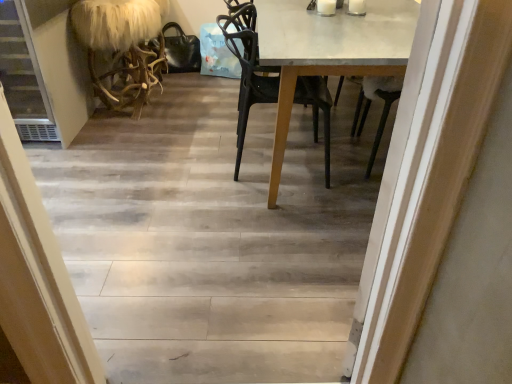
What do you see at coordinates (212, 237) in the screenshot?
I see `wooden floor at center` at bounding box center [212, 237].

Measure the distance between point (127, 210) and camera.

The distance of point (127, 210) from camera is 2.04 meters.

What do you see at coordinates (329, 51) in the screenshot? The width and height of the screenshot is (512, 384). I see `white glossy table at center` at bounding box center [329, 51].

What do you see at coordinates (122, 48) in the screenshot?
I see `fuzzy white fur at left` at bounding box center [122, 48].

Where is `black matte chair at center`? The height and width of the screenshot is (384, 512). black matte chair at center is located at coordinates (248, 69).

Find the location of a particular element. The width and height of the screenshot is (512, 384). wooden floor at center is located at coordinates (212, 237).

From the image's perspective, does white glossy table at center appear lower than fuzzy white fur at left?

Yes, from the image's perspective, white glossy table at center is beneath fuzzy white fur at left.

Consider the image. Could you tell me if white glossy table at center is facing fuzzy white fur at left?

Yes, white glossy table at center is turned towards fuzzy white fur at left.

From a real-world perspective, is white glossy table at center under fuzzy white fur at left?

Incorrect, from a real-world perspective, white glossy table at center is higher than fuzzy white fur at left.

Looking at this image, can you confirm if white glossy table at center is bigger than fuzzy white fur at left?

Indeed, white glossy table at center has a larger size compared to fuzzy white fur at left.

From a real-world perspective, is black matte chair at center located higher than white glossy table at center?

Yes, from a real-world perspective, black matte chair at center is on top of white glossy table at center.

How far apart are black matte chair at center and white glossy table at center?

11.37 inches.

Would you say black matte chair at center is to the left or to the right of white glossy table at center in the picture?

black matte chair at center is to the left of white glossy table at center.

Is black matte chair at center beside white glossy table at center?

No, black matte chair at center is not with white glossy table at center.

Is fuzzy white fur at left positioned behind wooden floor at center?

That is True.

Considering the relative sizes of fuzzy white fur at left and wooden floor at center in the image provided, is fuzzy white fur at left taller than wooden floor at center?

Indeed, fuzzy white fur at left has a greater height compared to wooden floor at center.

Would you say fuzzy white fur at left is inside or outside wooden floor at center?

fuzzy white fur at left is not inside wooden floor at center, it's outside.

From a real-world perspective, which object stands above the other?

fuzzy white fur at left.

From a real-world perspective, is black matte chair at center on wooden floor at center?

Correct, in the physical world, black matte chair at center is higher than wooden floor at center.

Is black matte chair at center next to wooden floor at center and touching it?

No, black matte chair at center is not making contact with wooden floor at center.

Is black matte chair at center spatially inside wooden floor at center, or outside of it?

black matte chair at center is located beyond the bounds of wooden floor at center.

Measure the distance between black matte chair at center and wooden floor at center.

black matte chair at center and wooden floor at center are 21.47 inches apart.

Which object is closer to the camera, white glossy table at center or black matte chair at center?

Positioned in front is white glossy table at center.

Is white glossy table at center facing towards black matte chair at center?

Yes, white glossy table at center is turned towards black matte chair at center.

Which is behind, point (311, 42) or point (317, 94)?

The point (317, 94) is farther.

Can black matte chair at center be found inside white glossy table at center?

Yes, white glossy table at center is surrounding black matte chair at center.

From the picture: From a real-world perspective, is wooden floor at center under black matte chair at center?

Yes.

Is point (123, 274) farther from viewer compared to point (247, 13)?

No, (123, 274) is in front of (247, 13).

Is there a large distance between wooden floor at center and black matte chair at center?

A: Actually, wooden floor at center and black matte chair at center are a little close together.

From the image's perspective, which one is positioned higher, fuzzy white fur at left or black matte chair at center?

fuzzy white fur at left appears higher in the image.

Consider the image. Which of these two, fuzzy white fur at left or black matte chair at center, is thinner?

fuzzy white fur at left is thinner.

What's the angular difference between fuzzy white fur at left and black matte chair at center's facing directions?

The facing directions of fuzzy white fur at left and black matte chair at center are 180 degrees apart.

Is fuzzy white fur at left to the left of black matte chair at center from the viewer's perspective?

Correct, you'll find fuzzy white fur at left to the left of black matte chair at center.

At what (x,y) coordinates should I click in order to perform the action: click on round table that is in front of the fuzzy white fur at left. Please return your answer as a coordinate pair (x, y). This screenshot has width=512, height=384. Looking at the image, I should click on (329, 51).

Identify the location of round table above the black matte chair at center (from the image's perspective). The width and height of the screenshot is (512, 384). (329, 51).

From the image, which object appears to be farther from black matte chair at center, wooden floor at center or fuzzy white fur at left?

Based on the image, fuzzy white fur at left appears to be further to black matte chair at center.

Which object lies nearer to the anchor point fuzzy white fur at left, black matte chair at center or wooden floor at center?

black matte chair at center lies closer to fuzzy white fur at left than the other object.

Considering their positions, is black matte chair at center positioned closer to white glossy table at center than wooden floor at center?

Based on the image, black matte chair at center appears to be nearer to white glossy table at center.

Looking at the image, which one is located closer to wooden floor at center, fuzzy white fur at left or white glossy table at center?

Among the two, white glossy table at center is located nearer to wooden floor at center.

When comparing their distances from wooden floor at center, does fuzzy white fur at left or black matte chair at center seem further?

fuzzy white fur at left is further to wooden floor at center.

Based on their spatial positions, is white glossy table at center or wooden floor at center further from fuzzy white fur at left?

The object further to fuzzy white fur at left is white glossy table at center.

Looking at the image, which one is located closer to wooden floor at center, black matte chair at center or white glossy table at center?

Based on the image, black matte chair at center appears to be nearer to wooden floor at center.

Looking at the image, which one is located closer to white glossy table at center, wooden floor at center or fuzzy white fur at left?

wooden floor at center is closer to white glossy table at center.

The height and width of the screenshot is (384, 512). Identify the location of chair between fuzzy white fur at left and white glossy table at center. (248, 69).

Find the location of `chair positioned between wooden floor at center and fuzzy white fur at left from near to far`. chair positioned between wooden floor at center and fuzzy white fur at left from near to far is located at coordinates (248, 69).

I want to click on chair located between wooden floor at center and white glossy table at center in the left-right direction, so click(248, 69).

Where is `stairwell located between fuzzy white fur at left and white glossy table at center in the left-right direction`? This screenshot has height=384, width=512. stairwell located between fuzzy white fur at left and white glossy table at center in the left-right direction is located at coordinates (212, 237).